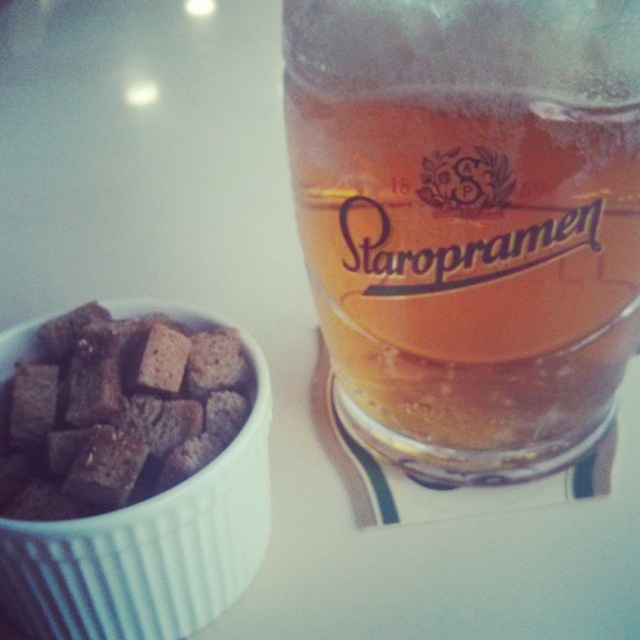
From the picture: Does translucent glass beer at upper right have a larger size compared to brown crumbly bread at left?

Yes.

This screenshot has height=640, width=640. What are the coordinates of `translucent glass beer at upper right` in the screenshot? It's located at (468, 221).

Is point (416, 228) positioned in front of point (157, 435)?

Yes, point (416, 228) is closer to viewer.

This screenshot has height=640, width=640. What are the coordinates of `translucent glass beer at upper right` in the screenshot? It's located at (468, 221).